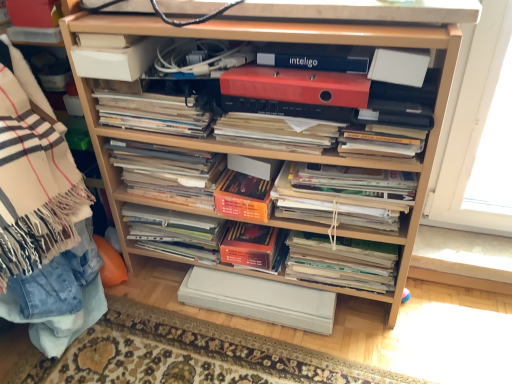
Find the location of a particular element. The image size is (512, 384). unoccupied area in front of blue matte inteligo at upper center, which appears as the second paperback book when viewed from the top is located at coordinates (335, 76).